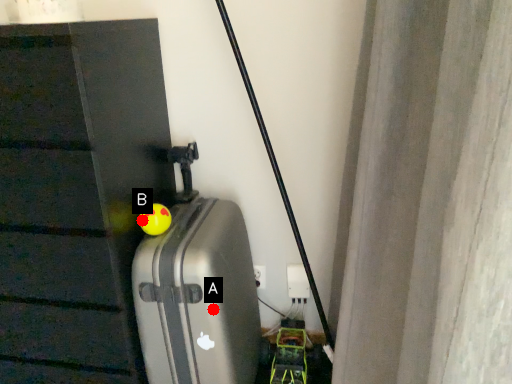
Question: Two points are circled on the image, labeled by A and B beside each circle. Which point is farther to the camera?

Choices:
 (A) A is further
 (B) B is further

Answer: (B)